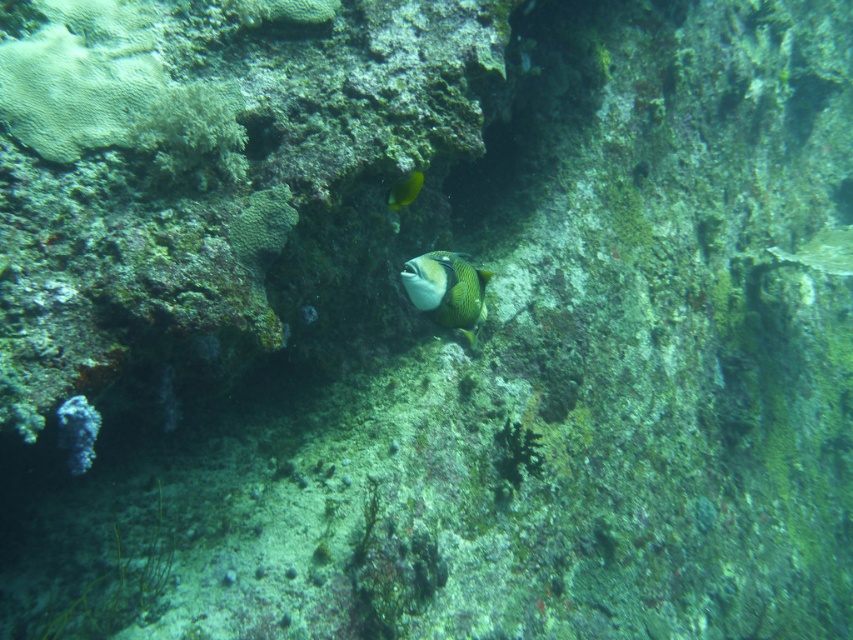
You are a marine biologist studying underwater life. You observe the green textured fish at center in the image. What are the coordinates of its position in the image?

The green textured fish at center is located at coordinates point (447,289).

You are a marine biologist observing an underwater scene. You notice a green textured fish at center and a yellow matte fish at upper center. Which fish is positioned to the right of the other?

Answer: The green textured fish at center is positioned to the right of the yellow matte fish at upper center.

You are a marine biologist diving at the coral reef and need to reach a specific point marked at coordinates point (x=485, y=316). If you are currently 2 meters away from that point, how much further do you need to swim to reach it?

The distance of point (x=485, y=316) from viewer is 2.34 meters. Since you are already 2 meters away, you need to swim an additional 0.34 meters to reach the point.